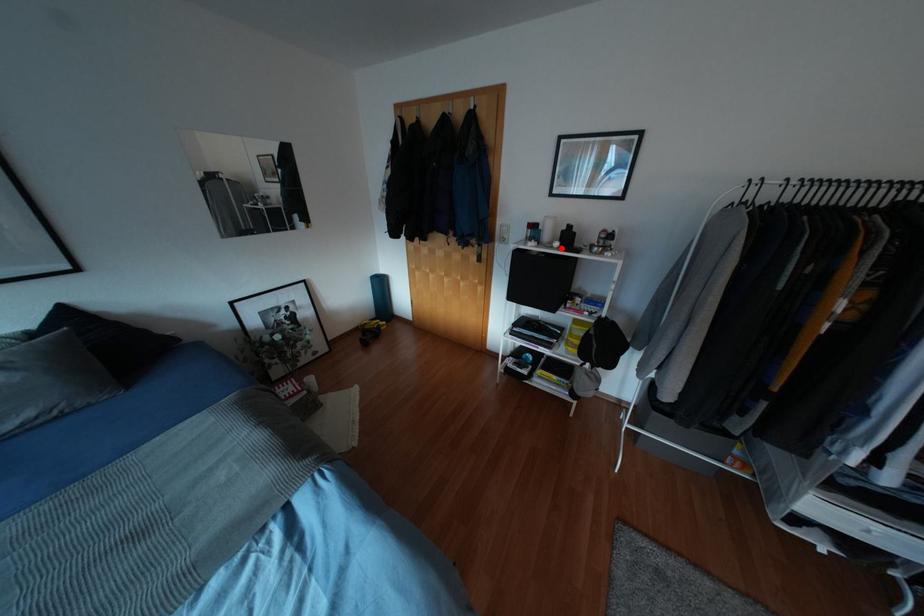
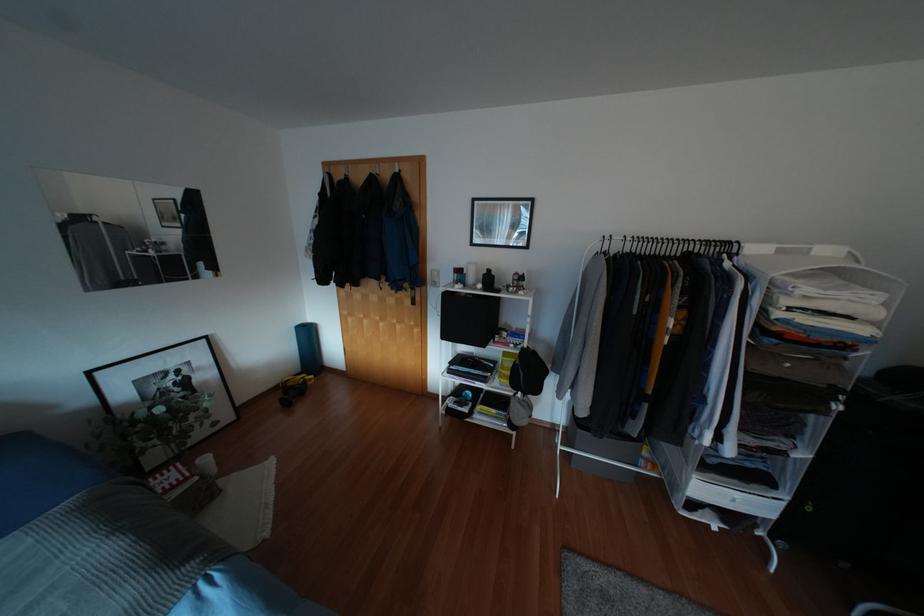
Find the pixel in the second image that matches the highlighted location in the first image.

(483, 289)